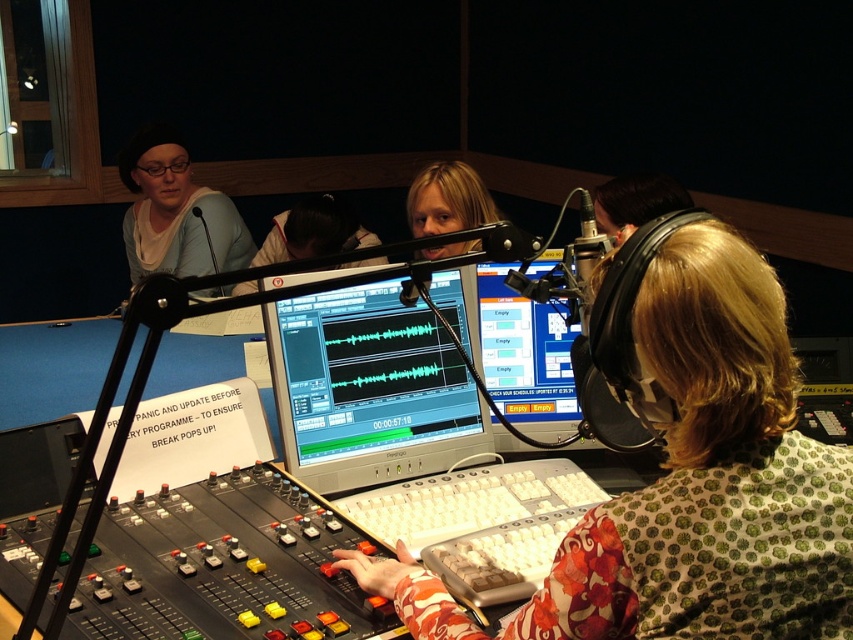
Question: Is floral fabric shirt at center below matte black monitor at center?

Choices:
 (A) no
 (B) yes

Answer: (B)

Question: Which point is farther from the camera taking this photo?

Choices:
 (A) (616, 220)
 (B) (492, 216)
 (C) (299, 227)
 (D) (792, 528)

Answer: (C)

Question: Is smooth black hair at center further to camera compared to blonde hair at center?

Choices:
 (A) yes
 (B) no

Answer: (A)

Question: Can you confirm if silver metallic monitor at center is positioned above matte black monitor at center?

Choices:
 (A) yes
 (B) no

Answer: (B)

Question: Estimate the real-world distances between objects in this image. Which object is farther from the matte black shirt at upper left?

Choices:
 (A) matte black headphones at upper right
 (B) blonde hair at center
 (C) smooth black hair at center

Answer: (A)

Question: Which of the following is the farthest from the observer?

Choices:
 (A) smooth black hair at center
 (B) matte black headphones at upper right

Answer: (A)